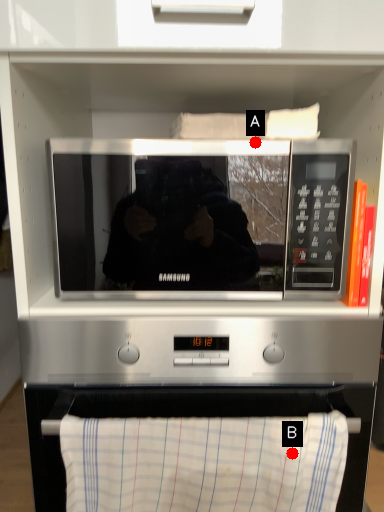
Question: Two points are circled on the image, labeled by A and B beside each circle. Which point is further to the camera?

Choices:
 (A) A is further
 (B) B is further

Answer: (B)